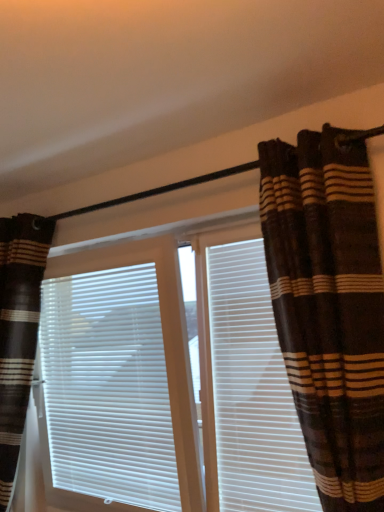
Question: Is brown striped curtains at center placed right next to white matte window blind at center?

Choices:
 (A) no
 (B) yes

Answer: (A)

Question: Considering the relative positions of brown striped curtains at center and white matte window blind at center in the image provided, is brown striped curtains at center behind white matte window blind at center?

Choices:
 (A) yes
 (B) no

Answer: (B)

Question: Is brown striped curtains at center to the right of white matte window blind at center from the viewer's perspective?

Choices:
 (A) yes
 (B) no

Answer: (A)

Question: Can you confirm if brown striped curtains at center is wider than white matte window blind at center?

Choices:
 (A) yes
 (B) no

Answer: (A)

Question: From a real-world perspective, is brown striped curtains at center positioned under white matte window blind at center based on gravity?

Choices:
 (A) yes
 (B) no

Answer: (B)

Question: Is point (104, 391) closer or farther from the camera than point (372, 224)?

Choices:
 (A) farther
 (B) closer

Answer: (A)

Question: From a real-world perspective, is white matte window blind at center positioned above or below brown striped curtain at right, placed as the 2th curtain when sorted from back to front?

Choices:
 (A) below
 (B) above

Answer: (A)

Question: Is white matte window blind at center in front of or behind brown striped curtain at right, the 1th curtain positioned from the front, in the image?

Choices:
 (A) front
 (B) behind

Answer: (B)

Question: Considering the positions of white matte window blind at center and brown striped curtain at right, the 1th curtain viewed from the right, in the image, is white matte window blind at center wider or thinner than brown striped curtain at right, the 1th curtain viewed from the right,?

Choices:
 (A) wide
 (B) thin

Answer: (B)

Question: From the image's perspective, is white matte window blind at center above or below white plastic shutter at center?

Choices:
 (A) above
 (B) below

Answer: (B)

Question: Would you say white matte window blind at center is inside or outside white plastic shutter at center?

Choices:
 (A) outside
 (B) inside

Answer: (A)

Question: Is white matte window blind at center in front of or behind white plastic shutter at center in the image?

Choices:
 (A) front
 (B) behind

Answer: (B)

Question: From their relative heights in the image, would you say white matte window blind at center is taller or shorter than white plastic shutter at center?

Choices:
 (A) short
 (B) tall

Answer: (A)

Question: From the image's perspective, relative to white plastic shutter at center, is brown striped curtains at center above or below?

Choices:
 (A) above
 (B) below

Answer: (B)

Question: In terms of size, does brown striped curtains at center appear bigger or smaller than white plastic shutter at center?

Choices:
 (A) small
 (B) big

Answer: (B)